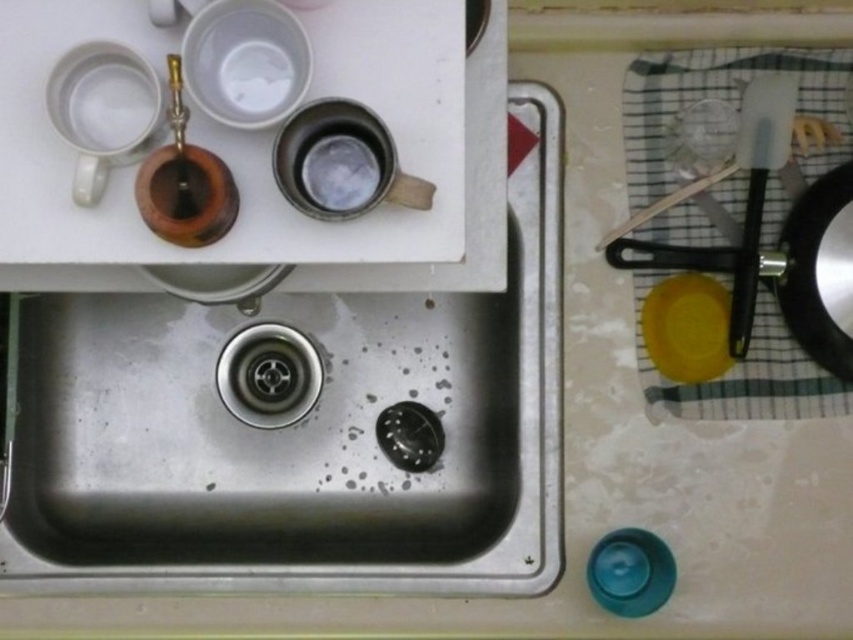
Question: Is stainless steel sink at center thinner than black non-stick frying pan at right?

Choices:
 (A) yes
 (B) no

Answer: (B)

Question: Which point is farther to the camera?

Choices:
 (A) (798, 296)
 (B) (491, 317)

Answer: (B)

Question: Among these objects, which one is nearest to the camera?

Choices:
 (A) stainless steel sink at center
 (B) black non-stick frying pan at right

Answer: (B)

Question: Can you confirm if stainless steel sink at center is positioned above black non-stick frying pan at right?

Choices:
 (A) yes
 (B) no

Answer: (B)

Question: Is stainless steel sink at center to the right of black non-stick frying pan at right from the viewer's perspective?

Choices:
 (A) no
 (B) yes

Answer: (A)